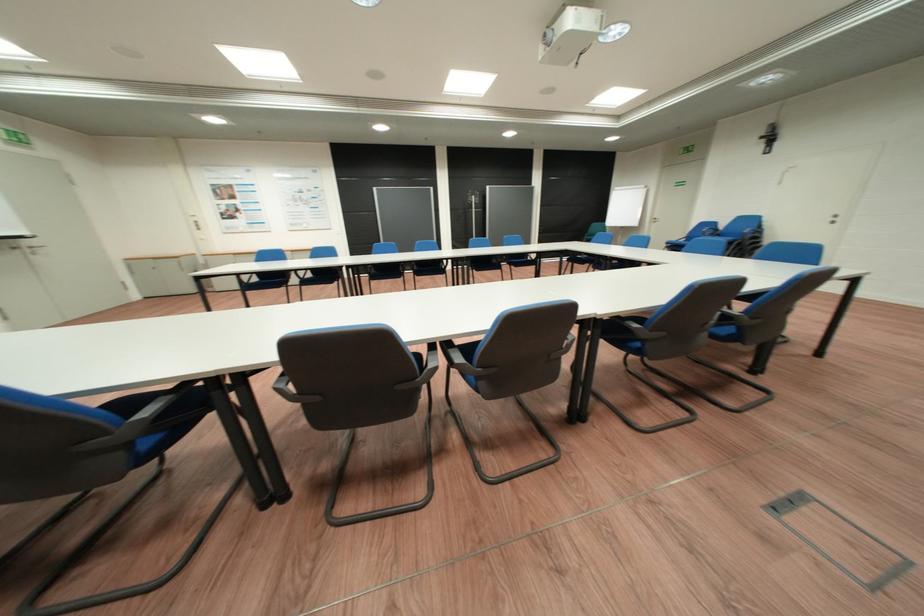
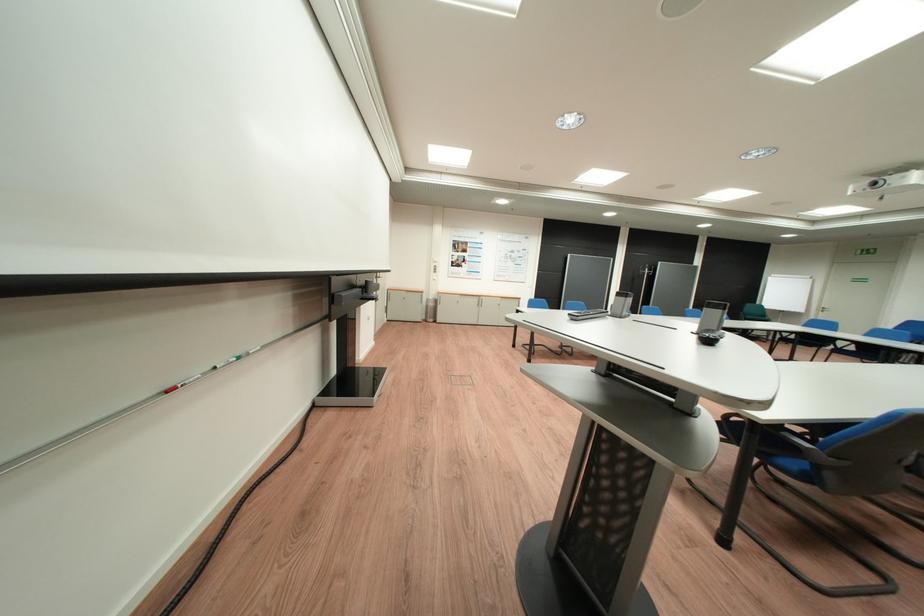
Question: What movement of the cameraman would produce the second image?

Choices:
 (A) Left
 (B) Right
 (C) Forward
 (D) Backward

Answer: (A)